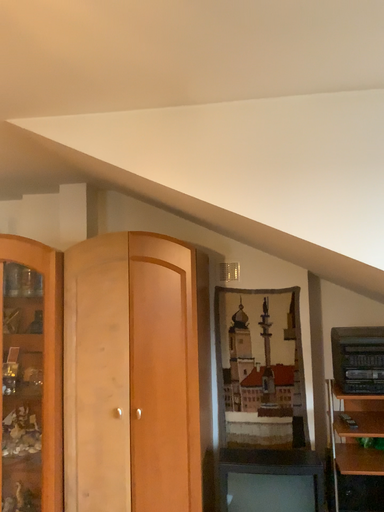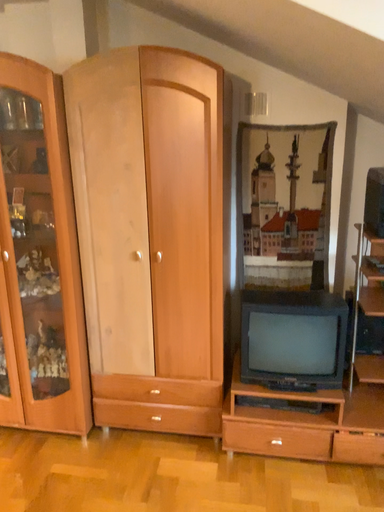
Question: Which way did the camera rotate in the video?

Choices:
 (A) rotated downward
 (B) rotated upward

Answer: (A)